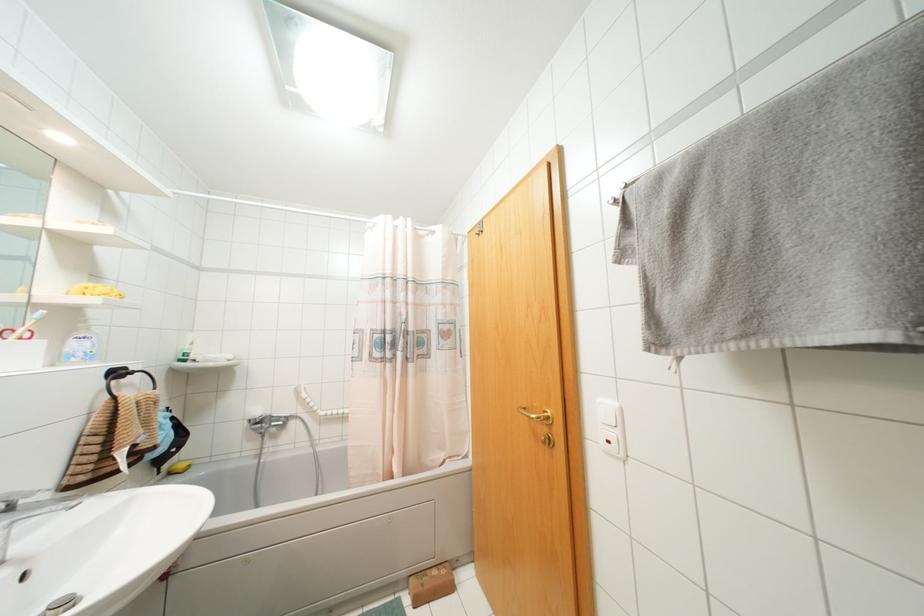
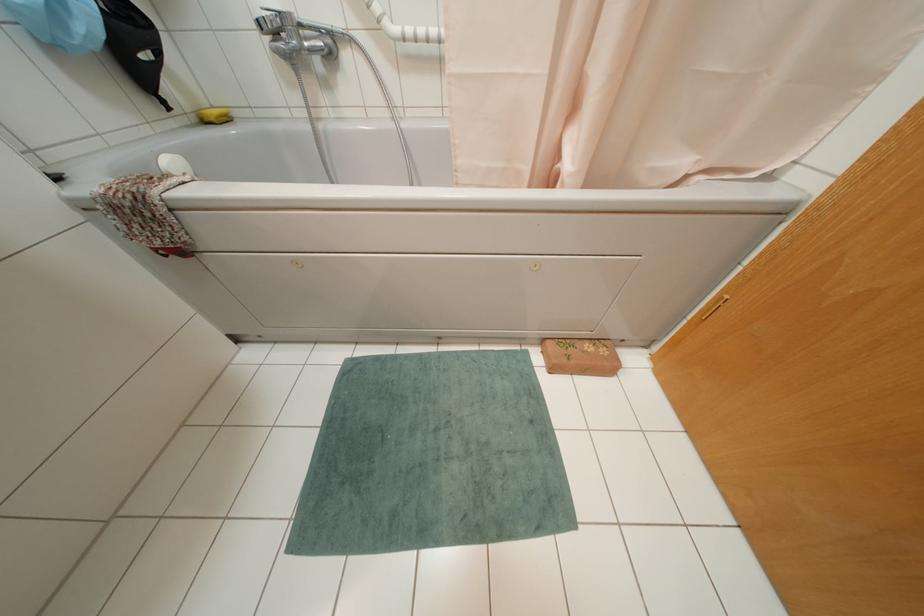
Find the pixel in the second image that matches (443,570) in the first image.

(602, 351)